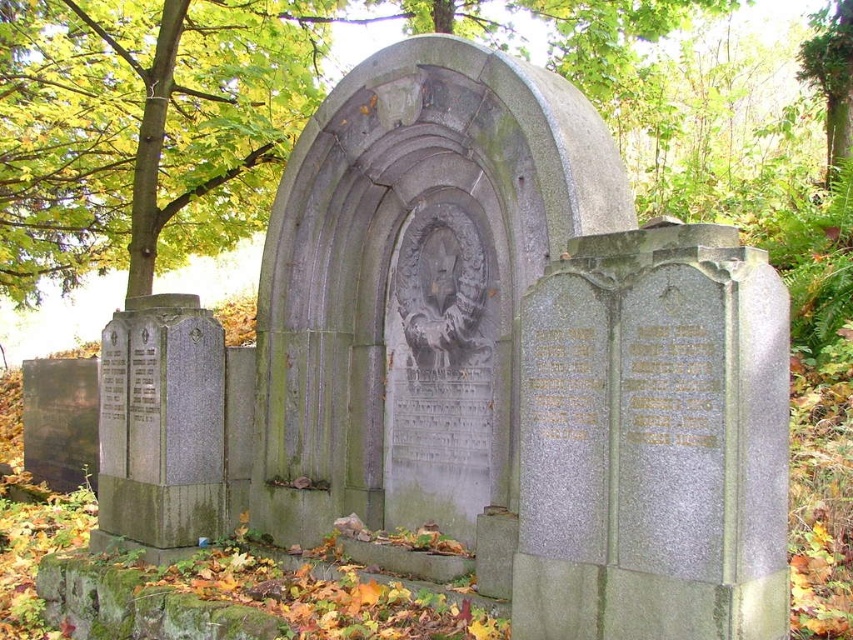
Question: Is green leafy tree at upper left wider than gray stone plaque at left?

Choices:
 (A) yes
 (B) no

Answer: (B)

Question: Which object is the farthest from the green leafy tree at upper center?

Choices:
 (A) green leafy tree at upper left
 (B) gray stone plaque at left

Answer: (B)

Question: Does green leafy tree at upper center appear on the left side of gray stone plaque at left?

Choices:
 (A) yes
 (B) no

Answer: (A)

Question: Estimate the real-world distances between objects in this image. Which object is closer to the green leafy tree at upper center?

Choices:
 (A) green leafy tree at upper left
 (B) gray stone plaque at left

Answer: (A)

Question: Which point is farther to the camera?

Choices:
 (A) gray stone plaque at left
 (B) green leafy tree at upper center

Answer: (B)

Question: Does green leafy tree at upper center appear on the left side of gray stone plaque at left?

Choices:
 (A) yes
 (B) no

Answer: (A)